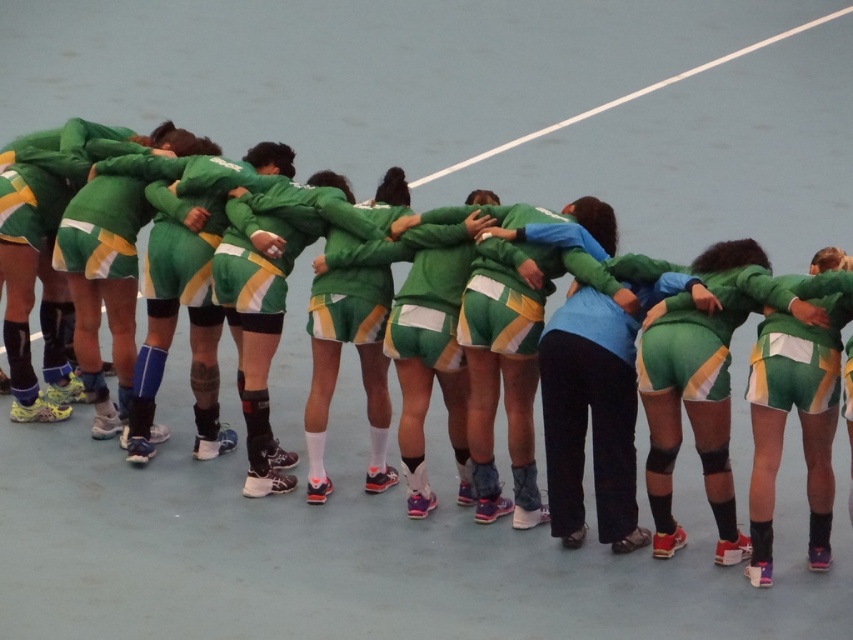
Can you confirm if green jersey at center is positioned below white line at upper center?

Correct, green jersey at center is located below white line at upper center.

Is green jersey at center bigger than white line at upper center?

No.

Does point (799, 410) come farther from viewer compared to point (770, 35)?

No, it is in front of (770, 35).

Locate an element on the screen. green jersey at center is located at coordinates (801, 348).

Who is higher up, green matte jersey at center or white line at upper center?

white line at upper center

This screenshot has height=640, width=853. What are the coordinates of `green matte jersey at center` in the screenshot? It's located at pyautogui.click(x=338, y=365).

I want to click on green matte jersey at center, so click(x=338, y=365).

Does green matte jersey at center appear under green jersey at center?

No, green matte jersey at center is not below green jersey at center.

Locate an element on the screen. The width and height of the screenshot is (853, 640). green matte jersey at center is located at coordinates (338, 365).